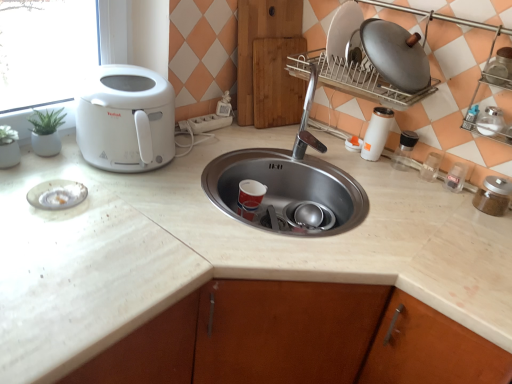
Image resolution: width=512 pixels, height=384 pixels. I want to click on blank space situated above white marble countertop at center (from a real-world perspective), so click(x=295, y=156).